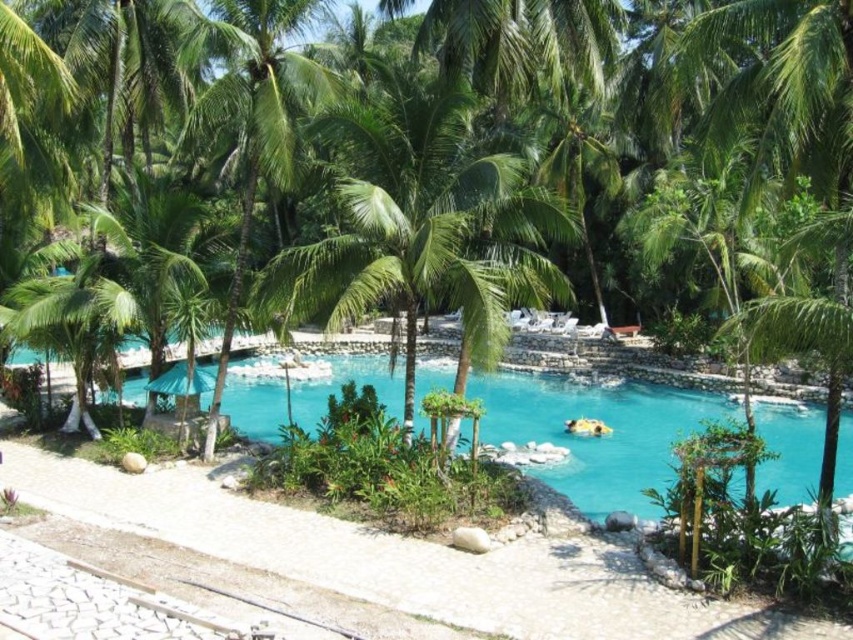
Can you confirm if green leafy palm tree at center is wider than turquoise glossy water at center?

Incorrect, green leafy palm tree at center's width does not surpass turquoise glossy water at center's.

Is green leafy palm tree at center below turquoise glossy water at center?

Incorrect, green leafy palm tree at center is not positioned below turquoise glossy water at center.

Describe the element at coordinates (422, 228) in the screenshot. The image size is (853, 640). I see `green leafy palm tree at center` at that location.

Image resolution: width=853 pixels, height=640 pixels. Find the location of `green leafy palm tree at center`. green leafy palm tree at center is located at coordinates (422, 228).